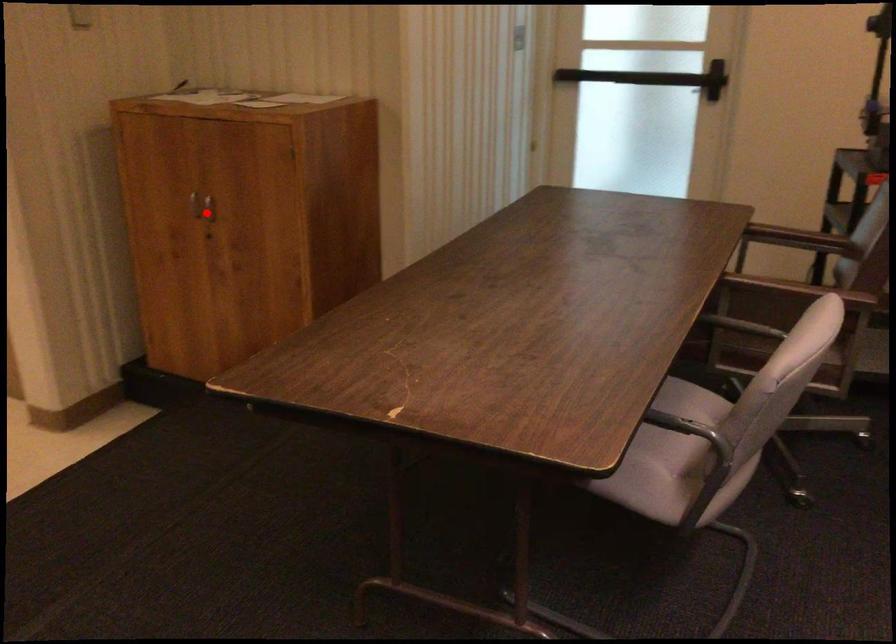
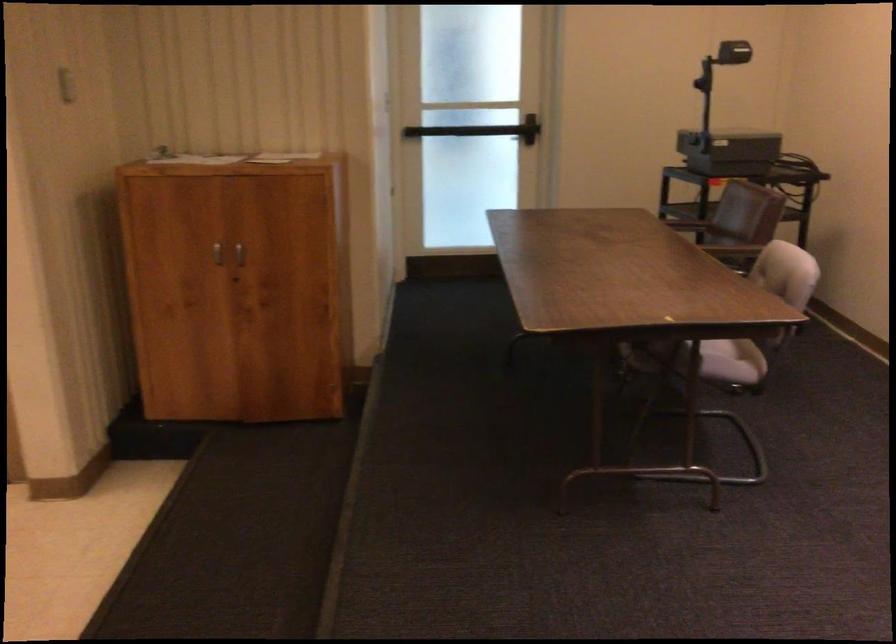
Locate, in the second image, the point that corresponds to the highlighted location in the first image.

(238, 258)